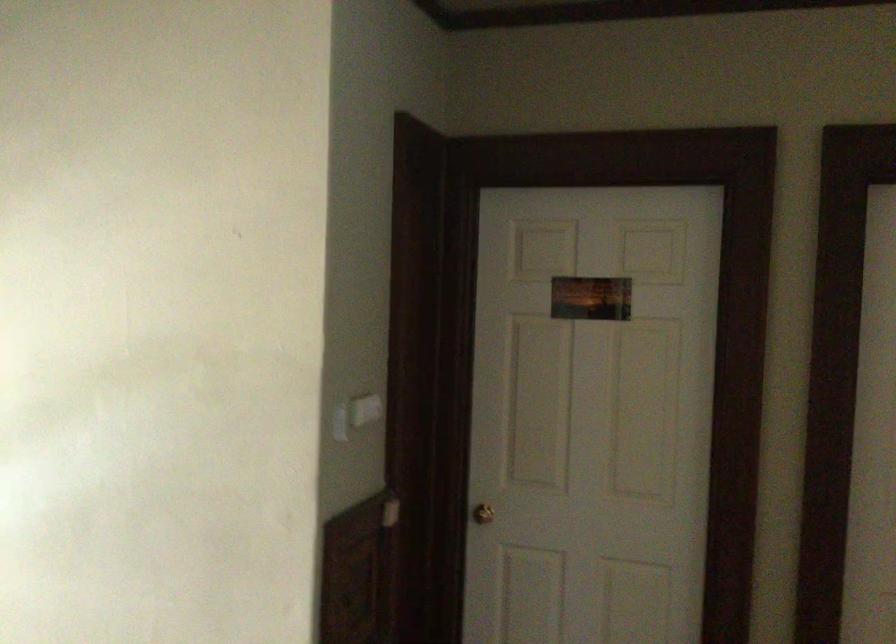
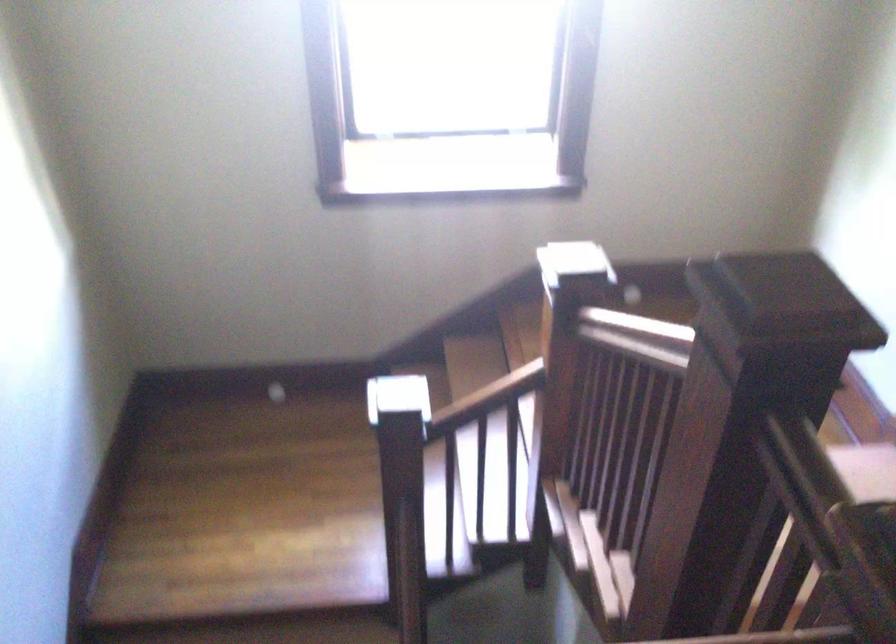
Based on the continuous images, in which direction is the camera rotating?

The rotation direction of the camera is left-down.